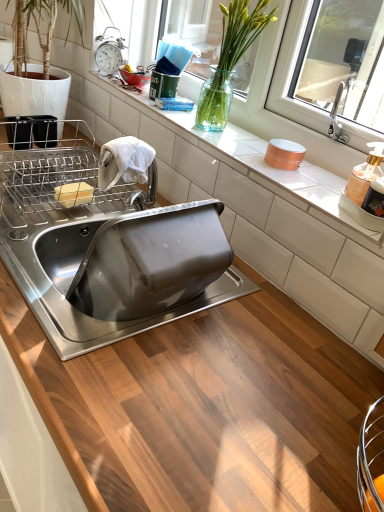
Question: From the image's perspective, is transparent glass vase at upper center on translucent glass vase at upper center?

Choices:
 (A) no
 (B) yes

Answer: (B)

Question: Is transparent glass vase at upper center not close to translucent glass vase at upper center?

Choices:
 (A) no
 (B) yes

Answer: (A)

Question: Does transparent glass vase at upper center turn towards translucent glass vase at upper center?

Choices:
 (A) yes
 (B) no

Answer: (A)

Question: Is transparent glass vase at upper center next to translucent glass vase at upper center?

Choices:
 (A) yes
 (B) no

Answer: (B)

Question: Is transparent glass vase at upper center bigger than translucent glass vase at upper center?

Choices:
 (A) no
 (B) yes

Answer: (B)

Question: From the image's perspective, is transparent glass vase at upper center below translucent glass vase at upper center?

Choices:
 (A) yes
 (B) no

Answer: (B)

Question: From the image's perspective, is metallic silver alarm clock at upper left on transparent glass vase at upper center?

Choices:
 (A) no
 (B) yes

Answer: (B)

Question: Is metallic silver alarm clock at upper left completely or partially outside of transparent glass vase at upper center?

Choices:
 (A) no
 (B) yes

Answer: (B)

Question: Is metallic silver alarm clock at upper left at the left side of transparent glass vase at upper center?

Choices:
 (A) no
 (B) yes

Answer: (B)

Question: Is transparent glass vase at upper center located within metallic silver alarm clock at upper left?

Choices:
 (A) yes
 (B) no

Answer: (B)

Question: Can you confirm if metallic silver alarm clock at upper left is shorter than transparent glass vase at upper center?

Choices:
 (A) yes
 (B) no

Answer: (A)

Question: Can you confirm if metallic silver alarm clock at upper left is wider than transparent glass vase at upper center?

Choices:
 (A) yes
 (B) no

Answer: (A)

Question: Does translucent plastic soap dispenser at right appear on the right side of stainless steel sink at center?

Choices:
 (A) yes
 (B) no

Answer: (A)